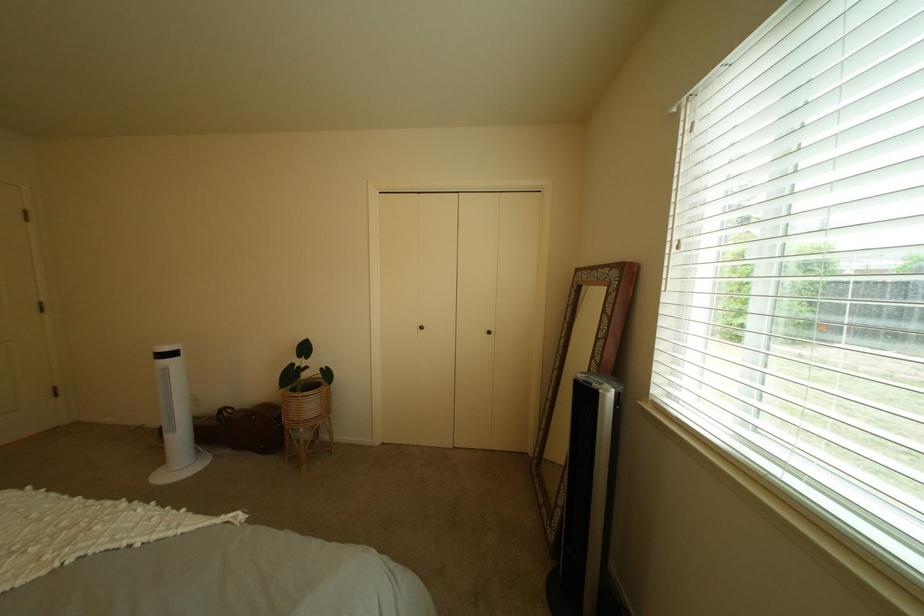
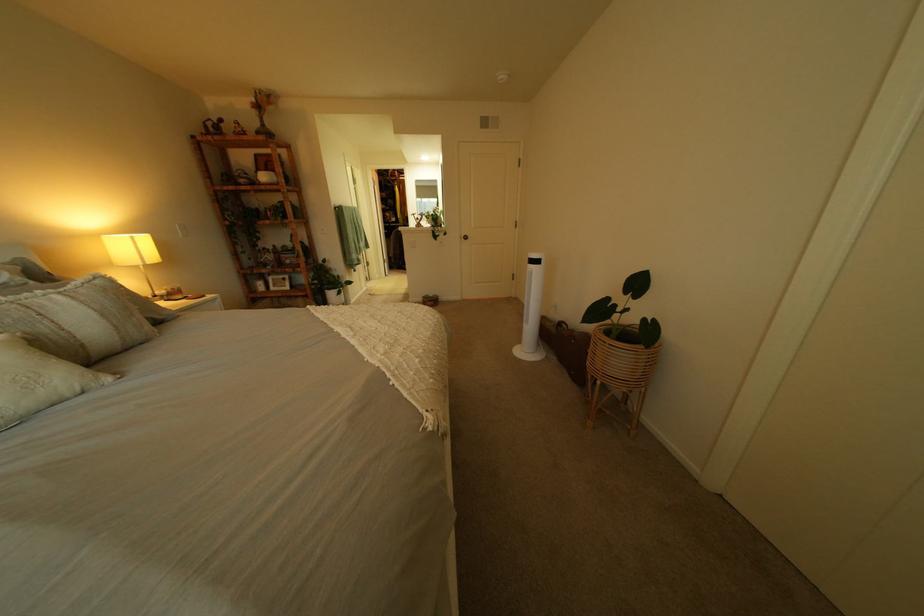
Based on the continuous images, in which direction is the camera rotating?

The camera rotated toward left-down.